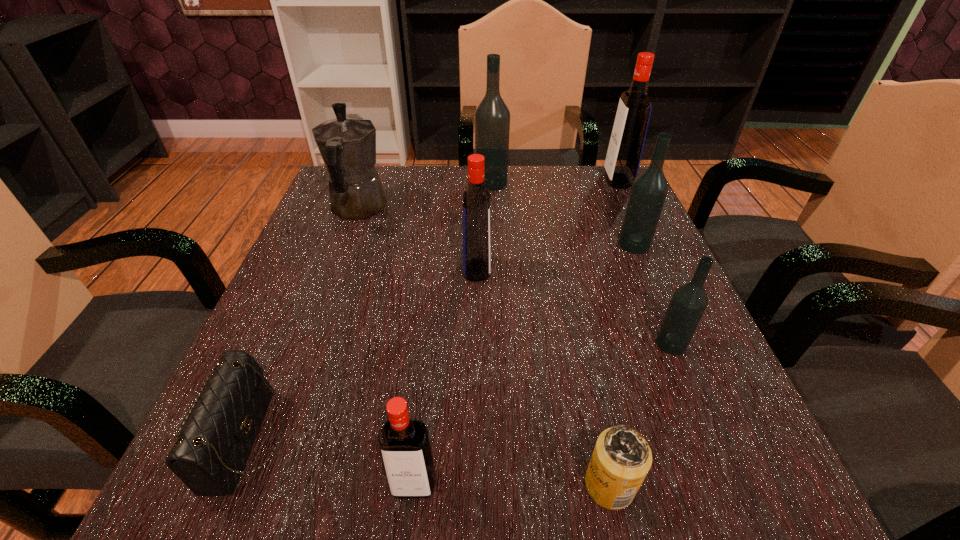
You are a GUI agent. You are given a task and a screenshot of the screen. Output one action in this format:
    pyautogui.click(x=<x>, y=<y>)
    Task: Click on the coffeepot at the left edge
    This screenshot has height=540, width=960.
    Given the screenshot: What is the action you would take?
    pyautogui.click(x=347, y=144)

Find the location of a particular element. Image resolution: width=960 pixels, height=540 pixels. clutch bag that is positioned at the left edge is located at coordinates (209, 455).

I want to click on object located at the far left corner, so click(347, 144).

Where is `object that is at the near left corner`? object that is at the near left corner is located at coordinates (209, 455).

Locate an element on the screen. object that is positioned at the far right corner is located at coordinates (626, 144).

In the image, there is a desktop. Where is `vacant space at the far edge`? The height and width of the screenshot is (540, 960). vacant space at the far edge is located at coordinates (440, 179).

Identify the location of vacant space at the near edge of the desktop. (534, 455).

The height and width of the screenshot is (540, 960). In the image, there is a desktop. Identify the location of free space at the left edge. (320, 308).

Where is `vacant space at the right edge`? The image size is (960, 540). vacant space at the right edge is located at coordinates (627, 386).

The image size is (960, 540). Find the location of `vacant area at the near left corner`. vacant area at the near left corner is located at coordinates (268, 509).